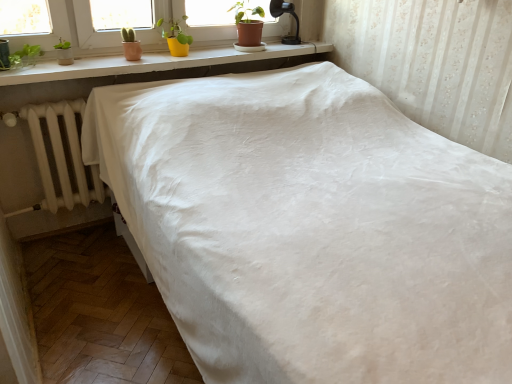
At what (x,y) coordinates should I click in order to perform the action: click on vacant space underneath matte brown pot at upper center, the 1th houseplant viewed from the right (from a real-world perspective). Please return your answer as a coordinate pair (x, y). Looking at the image, I should click on (252, 51).